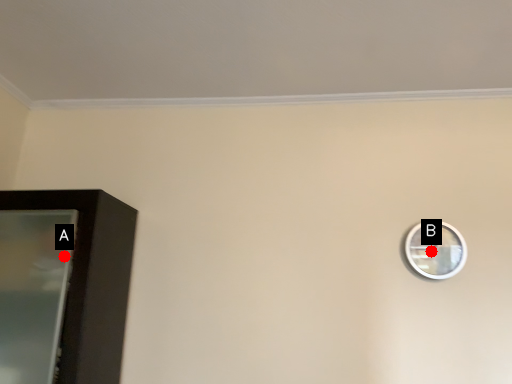
Question: Two points are circled on the image, labeled by A and B beside each circle. Which point appears farthest from the camera in this image?

Choices:
 (A) A is further
 (B) B is further

Answer: (B)